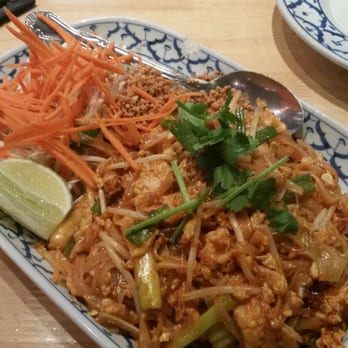
What are the coordinates of `white and blue china tray` in the screenshot? It's located at (337, 134).